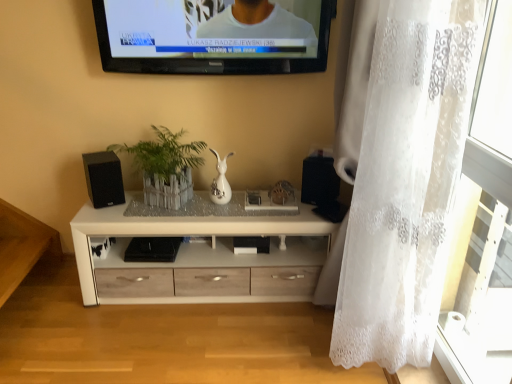
Identify the location of vacant space in front of black matte speaker at left, which is the 2th speaker in right-to-left order. The height and width of the screenshot is (384, 512). (102, 215).